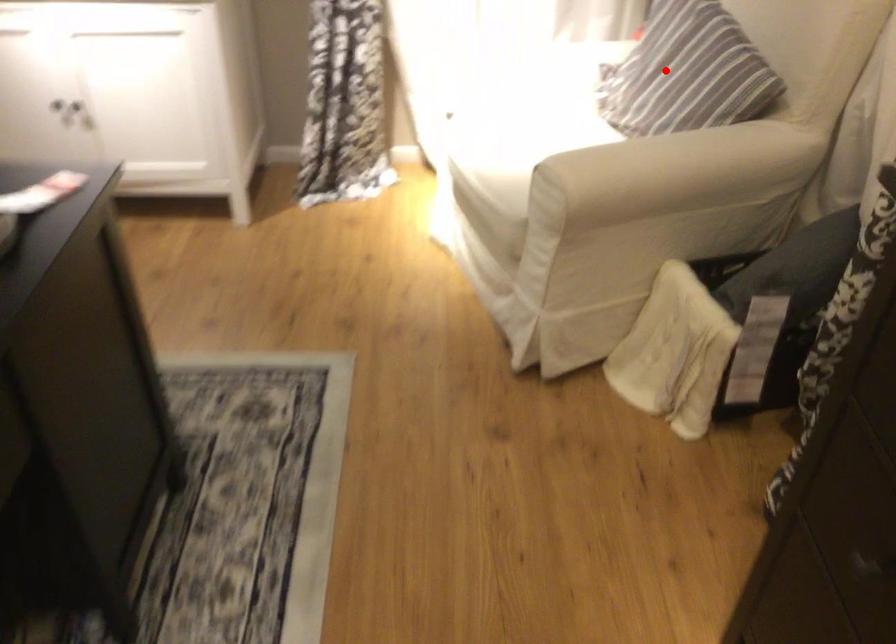
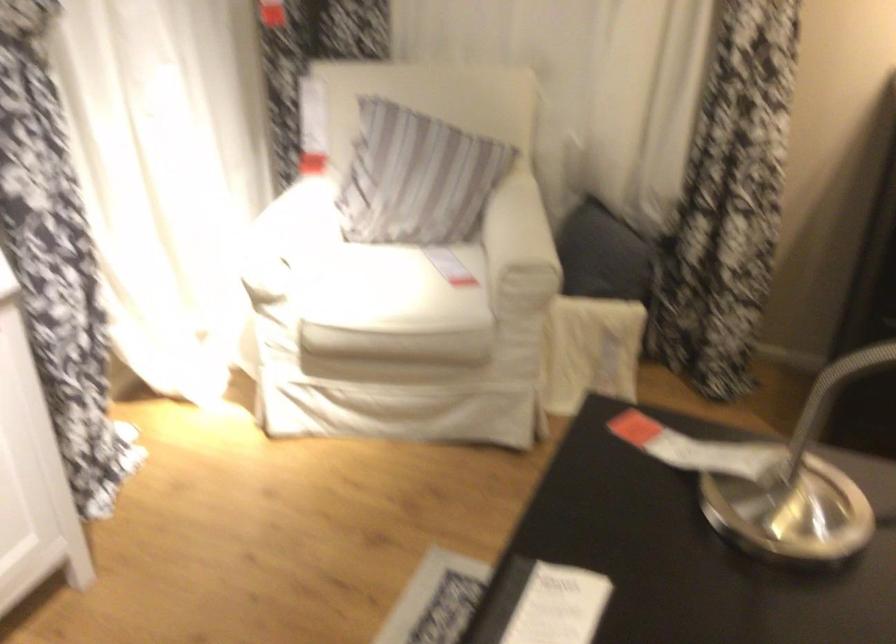
In the second image, find the point that corresponds to the highlighted location in the first image.

(416, 178)